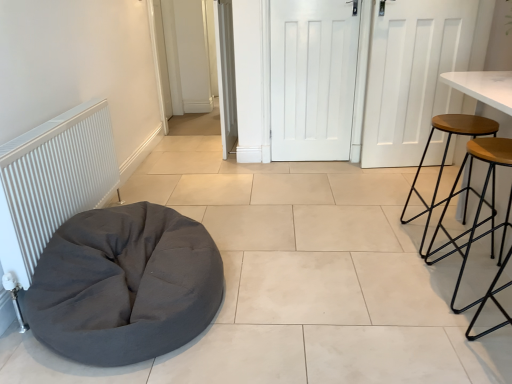
In order to face white matte door at center, positioned as the second door in right-to-left order, should I rotate leftwards or rightwards?

You should look right and rotate roughly 7.610 degrees.

I want to click on wooden seat stool at right, positioned as the second stool in front-to-back order, so click(446, 155).

This screenshot has height=384, width=512. What do you see at coordinates (125, 285) in the screenshot?
I see `dark gray fabric bean bag at lower left` at bounding box center [125, 285].

What is the approximate height of white ribbed radiator at left?

30.39 inches.

At what (x,y) coordinates should I click in order to perform the action: click on white matte door at center, positioned as the 2th door in left-to-right order. Please return your answer as a coordinate pair (x, y). The width and height of the screenshot is (512, 384). Looking at the image, I should click on (313, 78).

Does white ribbed radiator at left appear on the left side of wooden seat stool at right, which is the first stool in front-to-back order?

Yes, white ribbed radiator at left is to the left of wooden seat stool at right, which is the first stool in front-to-back order.

Which of these two, white ribbed radiator at left or wooden seat stool at right, which is the first stool in front-to-back order, is bigger?

With larger size is white ribbed radiator at left.

Looking at this image, considering the sizes of objects white ribbed radiator at left and wooden seat stool at right, which is the first stool in front-to-back order, in the image provided, who is shorter, white ribbed radiator at left or wooden seat stool at right, which is the first stool in front-to-back order,?

wooden seat stool at right, which is the first stool in front-to-back order, is shorter.

Can you tell me how much white ribbed radiator at left and wooden seat stool at right, acting as the second stool starting from the back, differ in facing direction?

0.575 degrees separate the facing orientations of white ribbed radiator at left and wooden seat stool at right, acting as the second stool starting from the back.

Does wooden seat stool at right, which is the first stool in front-to-back order, have a smaller size compared to white matte door at center, which is the 1th door from left to right?

Yes.

From a real-world perspective, which stool is the 2nd one underneath the white matte door at center, which is the 1th door from left to right? Please provide its 2D coordinates.

[(480, 225)]

Can you confirm if wooden seat stool at right, acting as the second stool starting from the back, is wider than white matte door at center, which is the 1th door from left to right?

Yes.

Are white matte door at center, positioned as the 3th door in right-to-left order, and wooden seat stool at right, positioned as the second stool in front-to-back order, far apart?

Absolutely, white matte door at center, positioned as the 3th door in right-to-left order, is distant from wooden seat stool at right, positioned as the second stool in front-to-back order.

In the scene shown: In terms of width, does white matte door at center, positioned as the 3th door in right-to-left order, look wider or thinner when compared to wooden seat stool at right, positioned as the second stool in front-to-back order?

In the image, white matte door at center, positioned as the 3th door in right-to-left order, appears to be more narrow than wooden seat stool at right, positioned as the second stool in front-to-back order.

Do you think white matte door at center, positioned as the 3th door in right-to-left order, is within wooden seat stool at right, positioned as the second stool in front-to-back order, or outside of it?

white matte door at center, positioned as the 3th door in right-to-left order, lies outside wooden seat stool at right, positioned as the second stool in front-to-back order.

Looking at this image, from the image's perspective, which is above, white matte door at center, positioned as the 3th door in right-to-left order, or wooden seat stool at right, positioned as the second stool in front-to-back order?

white matte door at center, positioned as the 3th door in right-to-left order, appears higher in the image.

Is dark gray fabric bean bag at lower left looking in the opposite direction of wooden seat stool at right, acting as the second stool starting from the back?

That's not correct — dark gray fabric bean bag at lower left is not looking away from wooden seat stool at right, acting as the second stool starting from the back.

Based on the photo, how different are the orientations of dark gray fabric bean bag at lower left and wooden seat stool at right, which is the first stool in front-to-back order, in degrees?

0.268 degrees separate the facing orientations of dark gray fabric bean bag at lower left and wooden seat stool at right, which is the first stool in front-to-back order.

Can you confirm if dark gray fabric bean bag at lower left is smaller than wooden seat stool at right, which is the first stool in front-to-back order?

Incorrect, dark gray fabric bean bag at lower left is not smaller in size than wooden seat stool at right, which is the first stool in front-to-back order.

Consider the image. From a real-world perspective, which is physically below, dark gray fabric bean bag at lower left or wooden seat stool at right, which is the first stool in front-to-back order?

dark gray fabric bean bag at lower left is physically lower.

I want to click on radiator that is under the white matte door at center, which ranks as the first door in right-to-left order (from a real-world perspective), so click(53, 181).

From the picture: How many degrees apart are the facing directions of white matte door at center, which ranks as the first door in right-to-left order, and white ribbed radiator at left?

There is a 72.9-degree angle between the facing directions of white matte door at center, which ranks as the first door in right-to-left order, and white ribbed radiator at left.

Considering the relative sizes of white matte door at center, which ranks as the first door in right-to-left order, and white ribbed radiator at left in the image provided, is white matte door at center, which ranks as the first door in right-to-left order, bigger than white ribbed radiator at left?

Incorrect, white matte door at center, which ranks as the first door in right-to-left order, is not larger than white ribbed radiator at left.

Based on their positions, is white matte door at center, the 3th door in the left-to-right sequence, located to the left or right of white ribbed radiator at left?

In the image, white matte door at center, the 3th door in the left-to-right sequence, appears on the right side of white ribbed radiator at left.

Is white matte door at center, positioned as the 2th door in left-to-right order, situated inside dark gray fabric bean bag at lower left or outside?

white matte door at center, positioned as the 2th door in left-to-right order, cannot be found inside dark gray fabric bean bag at lower left.

Is white matte door at center, positioned as the second door in right-to-left order, at the right side of dark gray fabric bean bag at lower left?

Indeed, white matte door at center, positioned as the second door in right-to-left order, is positioned on the right side of dark gray fabric bean bag at lower left.

Which is further, (281, 121) or (126, 211)?

The point (281, 121) is farther from the camera.

Which point is more forward, (216, 26) or (383, 143)?

The point (383, 143) is closer to the camera.

Considering the sizes of objects white matte door at center, which is the 1th door from left to right, and white matte door at center, the 3th door in the left-to-right sequence, in the image provided, who is taller, white matte door at center, which is the 1th door from left to right, or white matte door at center, the 3th door in the left-to-right sequence,?

white matte door at center, which is the 1th door from left to right, is taller.

Who is bigger, white matte door at center, which is the 1th door from left to right, or white matte door at center, which ranks as the first door in right-to-left order?

white matte door at center, which is the 1th door from left to right, is bigger.

Where is `the 2nd door positioned above the white matte door at center, the 3th door in the left-to-right sequence (from a real-world perspective)`? the 2nd door positioned above the white matte door at center, the 3th door in the left-to-right sequence (from a real-world perspective) is located at coordinates (226, 75).

Identify the location of radiator on the left of wooden seat stool at right, acting as the second stool starting from the back. (53, 181).

Starting from the white matte door at center, which is the 1th door from left to right, which stool is the 2nd one in front? Please provide its 2D coordinates.

[(480, 225)]

When comparing their distances from white matte door at center, positioned as the second door in right-to-left order, does white matte door at center, which ranks as the first door in right-to-left order, or wooden seat stool at right, acting as the second stool starting from the back, seem further?

wooden seat stool at right, acting as the second stool starting from the back, is positioned further to the anchor white matte door at center, positioned as the second door in right-to-left order.

Considering their positions, is white matte door at center, positioned as the 3th door in right-to-left order, positioned further to white ribbed radiator at left than dark gray fabric bean bag at lower left?

white matte door at center, positioned as the 3th door in right-to-left order.

Which object lies further to the anchor point dark gray fabric bean bag at lower left, wooden seat stool at right, the first stool in the back-to-front sequence, or white matte door at center, which ranks as the first door in right-to-left order?

white matte door at center, which ranks as the first door in right-to-left order, is positioned further to the anchor dark gray fabric bean bag at lower left.

When comparing their distances from white matte door at center, the 3th door in the left-to-right sequence, does white matte door at center, positioned as the second door in right-to-left order, or wooden seat stool at right, which is the first stool in front-to-back order, seem closer?

Among the two, white matte door at center, positioned as the second door in right-to-left order, is located nearer to white matte door at center, the 3th door in the left-to-right sequence.

Which object lies nearer to the anchor point white matte door at center, the 3th door in the left-to-right sequence, white matte door at center, positioned as the 2th door in left-to-right order, or white ribbed radiator at left?

Based on the image, white matte door at center, positioned as the 2th door in left-to-right order, appears to be nearer to white matte door at center, the 3th door in the left-to-right sequence.

Based on their spatial positions, is white ribbed radiator at left or white matte door at center, which ranks as the first door in right-to-left order, further from white matte door at center, positioned as the second door in right-to-left order?

white ribbed radiator at left lies further to white matte door at center, positioned as the second door in right-to-left order, than the other object.

When comparing their distances from white matte door at center, positioned as the second door in right-to-left order, does wooden seat stool at right, acting as the second stool starting from the back, or white matte door at center, positioned as the 3th door in right-to-left order, seem closer?

The object closer to white matte door at center, positioned as the second door in right-to-left order, is white matte door at center, positioned as the 3th door in right-to-left order.

Estimate the real-world distances between objects in this image. Which object is further from dark gray fabric bean bag at lower left, wooden seat stool at right, positioned as the second stool in front-to-back order, or white ribbed radiator at left?

wooden seat stool at right, positioned as the second stool in front-to-back order, is positioned further to the anchor dark gray fabric bean bag at lower left.

The height and width of the screenshot is (384, 512). Identify the location of stool between wooden seat stool at right, acting as the second stool starting from the back, and white matte door at center, which ranks as the first door in right-to-left order, from front to back. (446, 155).

Identify the location of furniture located between white ribbed radiator at left and white matte door at center, which ranks as the first door in right-to-left order, in the left-right direction. The image size is (512, 384). (125, 285).

Find the location of `stool between dark gray fabric bean bag at lower left and wooden seat stool at right, the first stool in the back-to-front sequence`. stool between dark gray fabric bean bag at lower left and wooden seat stool at right, the first stool in the back-to-front sequence is located at coordinates (480, 225).

Identify the location of furniture between white ribbed radiator at left and wooden seat stool at right, acting as the second stool starting from the back. pyautogui.click(x=125, y=285).